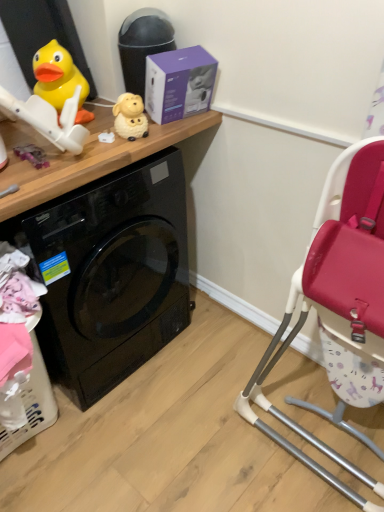
Question: From a real-world perspective, is purple matte box at upper center above or below black glossy washing machine at left?

Choices:
 (A) below
 (B) above

Answer: (B)

Question: Is purple matte box at upper center taller or shorter than black glossy washing machine at left?

Choices:
 (A) tall
 (B) short

Answer: (B)

Question: Based on their relative distances, which object is farther from the purple fabric toy at left, which is the 1th toy in left-to-right order?

Choices:
 (A) rubber duck at upper left, which ranks as the 2th toy in left-to-right order
 (B) black glossy washing machine at left
 (C) white glossy sheep at upper center, the first toy positioned from the right
 (D) purple matte box at upper center

Answer: (B)

Question: Which is nearer to the black glossy washing machine at left?

Choices:
 (A) white glossy sheep at upper center, the third toy viewed from the left
 (B) rubber duck at upper left, which ranks as the 2th toy in left-to-right order
 (C) purple fabric toy at left, which is the 1th toy in left-to-right order
 (D) purple matte box at upper center

Answer: (D)